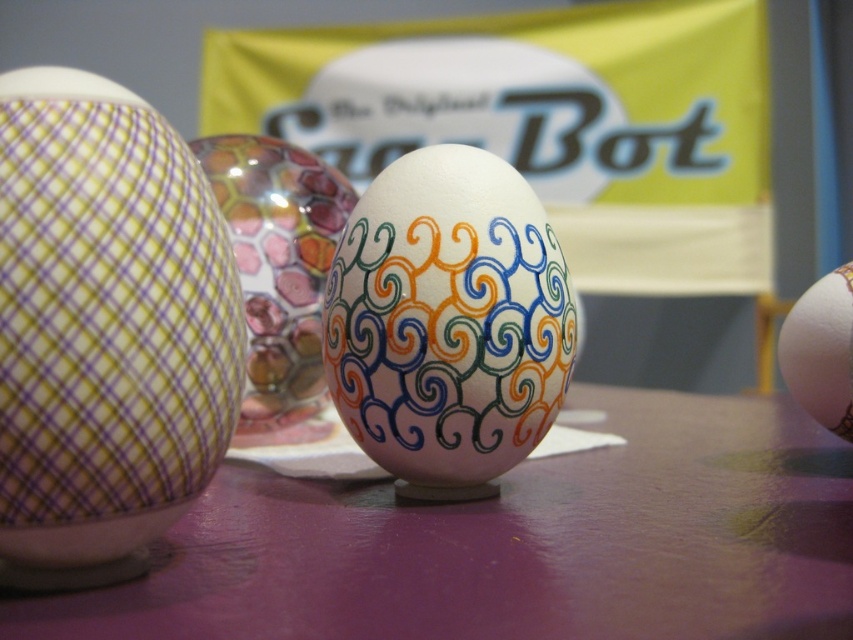
You are arranging a display of eggs on a purple matte table at center. You have a matte purple checkered egg at left to place. Considering the table height, will the egg be taller than the table?

The purple matte table at center has a lesser height compared to the matte purple checkered egg at left, so yes, the egg will be taller than the table.

From the picture: You are an art collector examining the eggs displayed on the flat surface. You notice the matte purple checkered egg at left and the matte white egg at right. Which egg has a greater width?

The matte purple checkered egg at left might be wider than the matte white egg at right according to the description.

You are an art student examining the eggs displayed on the table. You notice the matte purple checkered egg at left and the colorful painted egg at center. Which egg is placed lower on the table?

The matte purple checkered egg at left is positioned under the colorful painted egg at center, so it is placed lower on the table.